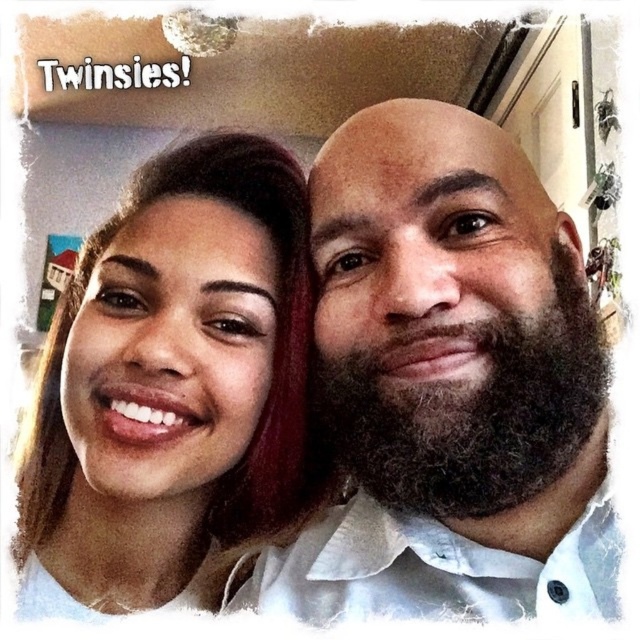
In the scene shown: Does matte white shirt at left have a greater width compared to dark brown thick beard at right?

Correct, the width of matte white shirt at left exceeds that of dark brown thick beard at right.

Can you confirm if matte white shirt at left is positioned to the right of dark brown thick beard at right?

Incorrect, matte white shirt at left is not on the right side of dark brown thick beard at right.

Does point (269, 440) come closer to viewer compared to point (346, 460)?

That is False.

At what (x,y) coordinates should I click in order to perform the action: click on matte white shirt at left. Please return your answer as a coordinate pair (x, y). The width and height of the screenshot is (640, 640). Looking at the image, I should click on (172, 378).